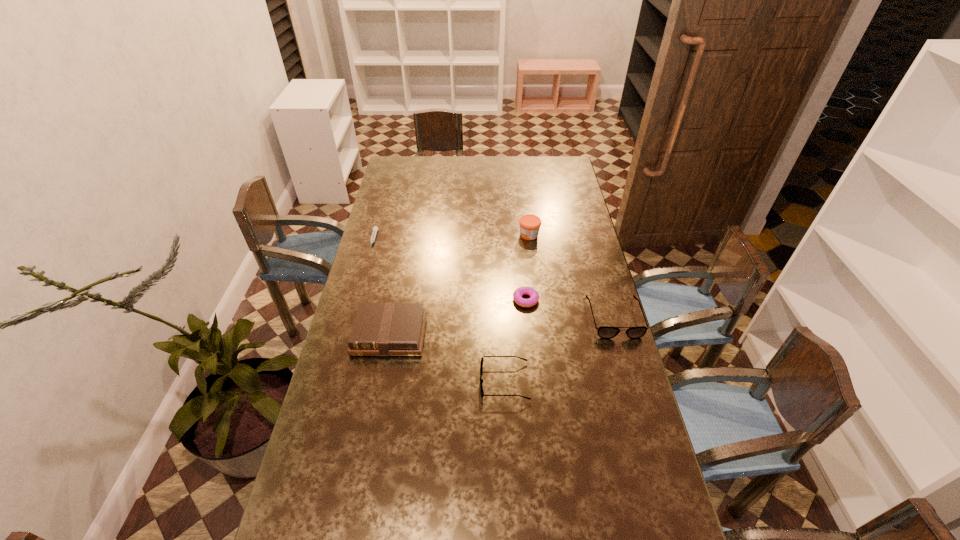
This screenshot has width=960, height=540. I want to click on free area in between the second shortest object and the tallest object, so click(527, 267).

The image size is (960, 540). Identify the location of vacant space that's between the shortest object and the jam. (451, 238).

Locate an element on the screen. This screenshot has height=540, width=960. free space between the right spectacles and the shorter spectacles is located at coordinates (560, 350).

Find the location of a particular element. The width and height of the screenshot is (960, 540). vacant area that lies between the second object from left to right and the farther spectacles is located at coordinates (502, 326).

This screenshot has width=960, height=540. I want to click on vacant space that is in between the nearer spectacles and the tallest object, so click(x=516, y=308).

Identify the location of free space that is in between the syringe and the taller spectacles. (494, 279).

This screenshot has width=960, height=540. Find the location of `free spot between the doughnut and the left spectacles`. free spot between the doughnut and the left spectacles is located at coordinates (516, 341).

Where is `object identified as the fifth closest to the syringe`? object identified as the fifth closest to the syringe is located at coordinates (605, 332).

Image resolution: width=960 pixels, height=540 pixels. I want to click on object that is the second closest to the syringe, so click(530, 224).

At what (x,y) coordinates should I click in order to perform the action: click on vacant area that satisfies the following two spatial constraints: 1. on the front-facing side of the rightmost object; 2. on the front-facing side of the shorter spectacles. Please return your answer as a coordinate pair (x, y). This screenshot has width=960, height=540. Looking at the image, I should click on (633, 381).